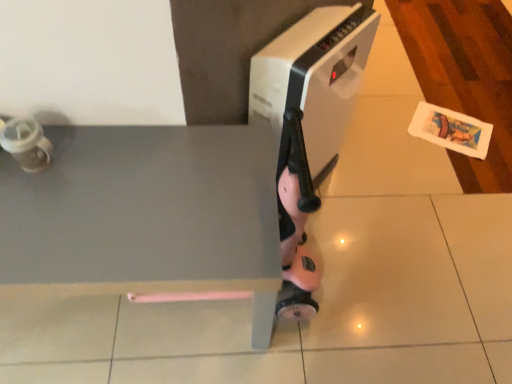
Question: Is white plastic heater at center taller than matte gray table at lower left?

Choices:
 (A) no
 (B) yes

Answer: (B)

Question: Is the position of white plastic heater at center more distant than that of matte gray table at lower left?

Choices:
 (A) no
 (B) yes

Answer: (B)

Question: Is white plastic heater at center completely or partially outside of matte gray table at lower left?

Choices:
 (A) no
 (B) yes

Answer: (B)

Question: Considering the relative positions of white plastic heater at center and matte gray table at lower left in the image provided, is white plastic heater at center to the right of matte gray table at lower left from the viewer's perspective?

Choices:
 (A) no
 (B) yes

Answer: (B)

Question: Can matte gray table at lower left be found inside white plastic heater at center?

Choices:
 (A) no
 (B) yes

Answer: (A)

Question: Can you see white plastic heater at center touching matte gray table at lower left?

Choices:
 (A) no
 (B) yes

Answer: (A)

Question: From a real-world perspective, is matte gray table at lower left on white plastic heater at center?

Choices:
 (A) yes
 (B) no

Answer: (B)

Question: Is matte gray table at lower left surrounding white plastic heater at center?

Choices:
 (A) yes
 (B) no

Answer: (B)

Question: Does matte gray table at lower left appear on the left side of white plastic heater at center?

Choices:
 (A) no
 (B) yes

Answer: (B)

Question: Is the position of matte gray table at lower left more distant than that of white plastic heater at center?

Choices:
 (A) yes
 (B) no

Answer: (B)

Question: Does matte gray table at lower left turn towards white plastic heater at center?

Choices:
 (A) yes
 (B) no

Answer: (B)

Question: From the image's perspective, would you say matte gray table at lower left is positioned over white plastic heater at center?

Choices:
 (A) no
 (B) yes

Answer: (A)

Question: Can you confirm if matte gray tile at center is bigger than white plastic heater at center?

Choices:
 (A) yes
 (B) no

Answer: (A)